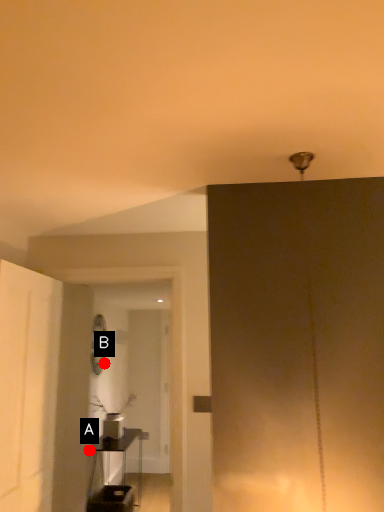
Question: Two points are circled on the image, labeled by A and B beside each circle. Which point is closer to the camera?

Choices:
 (A) A is closer
 (B) B is closer

Answer: (A)